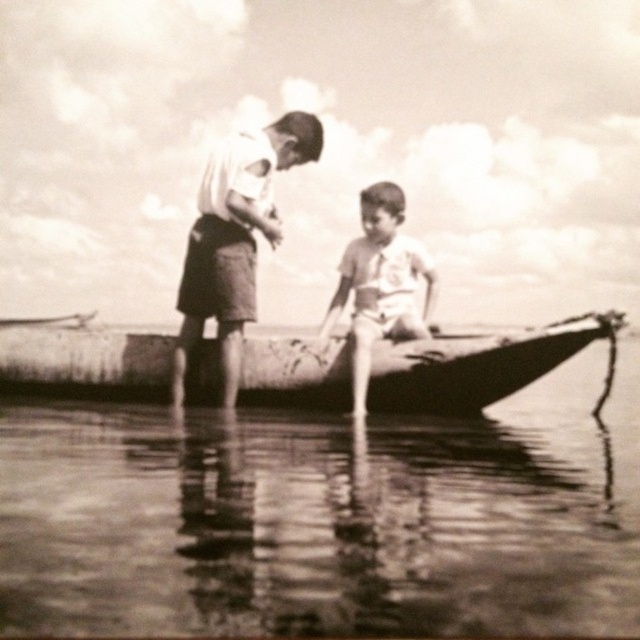
You are standing on the dock and want to place a 4.5 meter long fishing net between the smooth wood canoe at center and the smooth cotton shirt at center. Can the fishing net fit between them?

The smooth wood canoe at center is 4.35 meters from the smooth cotton shirt at center. Since the fishing net is 4.5 meters long, it is slightly longer than the distance between them, so the net cannot fit entirely between the smooth wood canoe at center and the smooth cotton shirt at center.

You are planning to place a small floating dock that is 1.2 meters long in the scene. Given the sizes of the smooth water at boat bottom and the smooth wood canoe at center, which object would be a better fit for the dock in terms of available space?

The smooth water at boat bottom is larger in size than the smooth wood canoe at center, so the dock would fit better there.